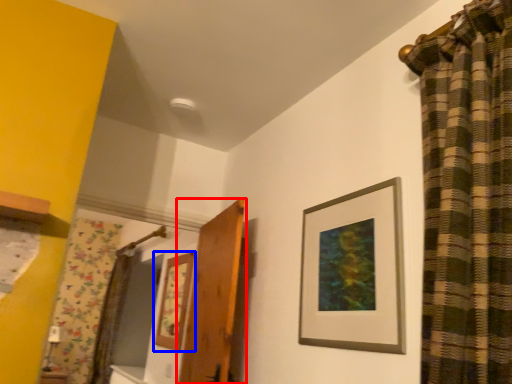
Question: Which of the following is the farthest to the observer, door (highlighted by a red box) or picture frame (highlighted by a blue box)?

Choices:
 (A) door
 (B) picture frame

Answer: (B)